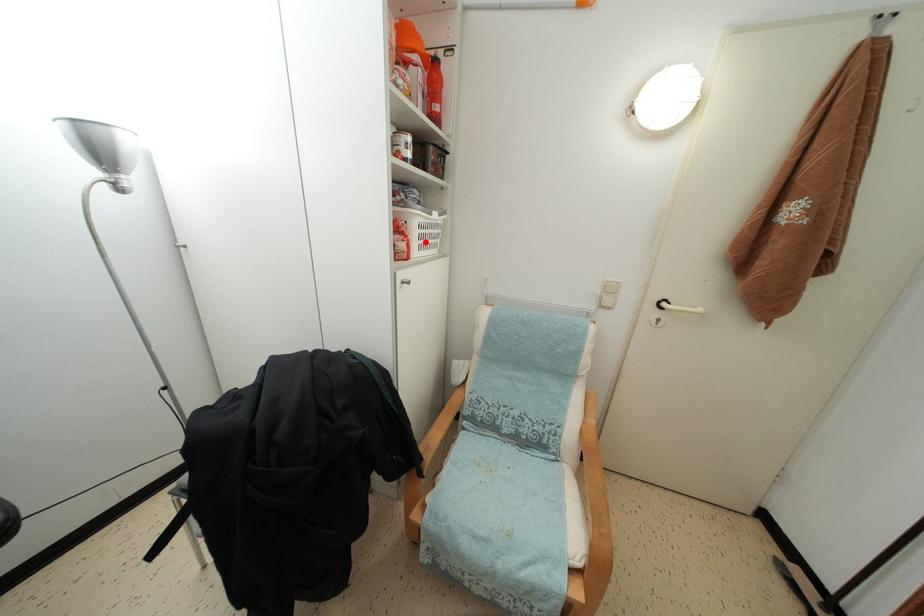
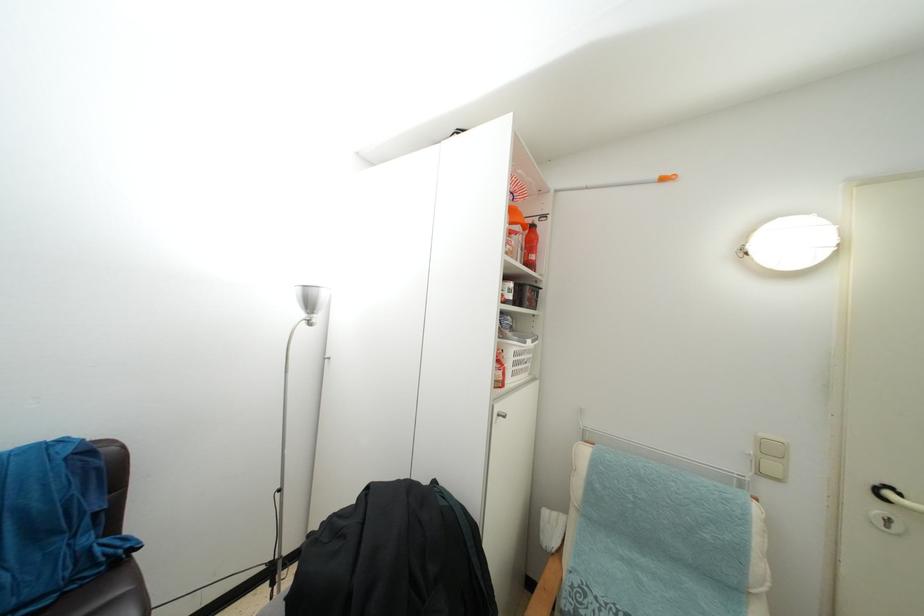
Question: I am providing you with two images of the same scene from different viewpoints. A red point is marked on the first image. Is the red point's position out of view in image 2?

Choices:
 (A) Yes
 (B) No

Answer: (B)